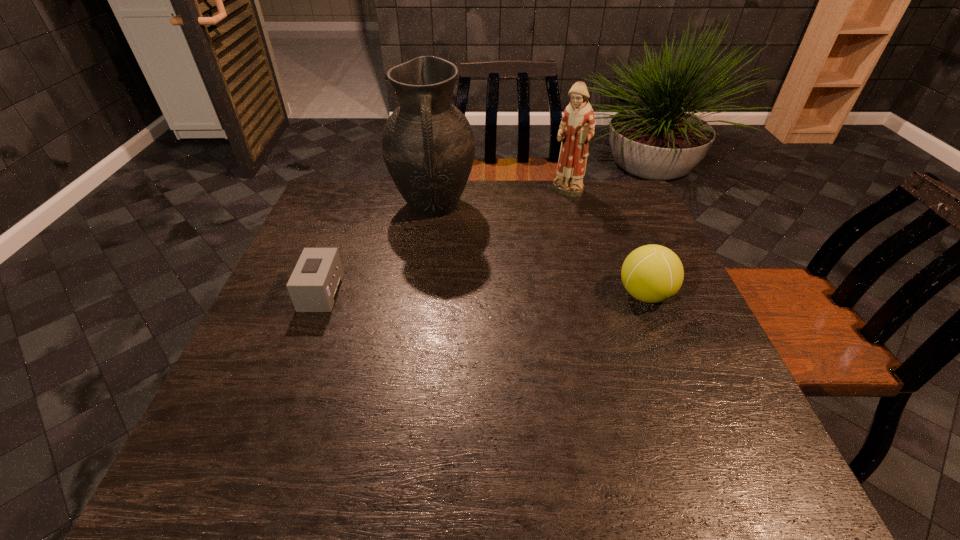
Find the location of a particular element. The image size is (960, 540). blank area at the far left corner is located at coordinates (334, 194).

Where is `vacant space at the near left corner of the desktop`? This screenshot has height=540, width=960. vacant space at the near left corner of the desktop is located at coordinates point(293,429).

The height and width of the screenshot is (540, 960). In order to click on free region at the near right corner in this screenshot , I will do `click(684, 412)`.

This screenshot has height=540, width=960. Identify the location of unoccupied position between the leftmost object and the tallest object. (377, 249).

Locate an element on the screen. This screenshot has height=540, width=960. vacant area between the second object from left to right and the shortest object is located at coordinates (377, 249).

Find the location of a particular element. free space between the shortest object and the second tallest object is located at coordinates (444, 242).

The image size is (960, 540). Find the location of `free space between the figurine and the pitcher`. free space between the figurine and the pitcher is located at coordinates pos(500,200).

Identify the location of vacant area that lies between the shortest object and the third shortest object. 444,242.

The height and width of the screenshot is (540, 960). I want to click on free area in between the second tallest object and the leftmost object, so click(444, 242).

This screenshot has width=960, height=540. Find the location of `free area in between the pitcher and the alarm clock`. free area in between the pitcher and the alarm clock is located at coordinates (377, 249).